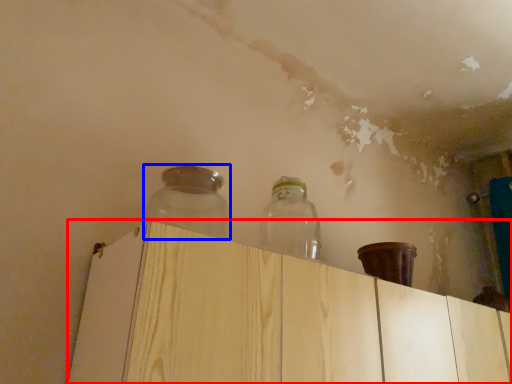
Question: Among these objects, which one is nearest to the camera, dresser (highlighted by a red box) or bottle (highlighted by a blue box)?

Choices:
 (A) dresser
 (B) bottle

Answer: (A)